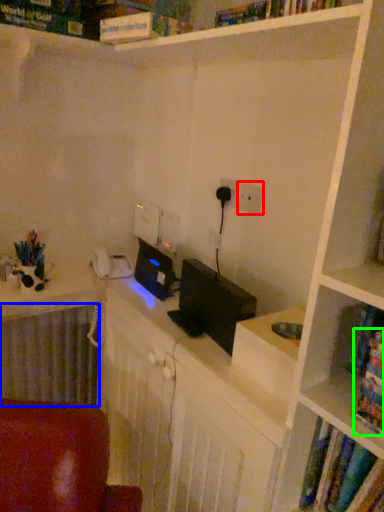
Question: Estimate the real-world distances between objects in this image. Which object is closer to electric outlet (highlighted by a red box), radiator (highlighted by a blue box) or book (highlighted by a green box)?

Choices:
 (A) radiator
 (B) book

Answer: (B)